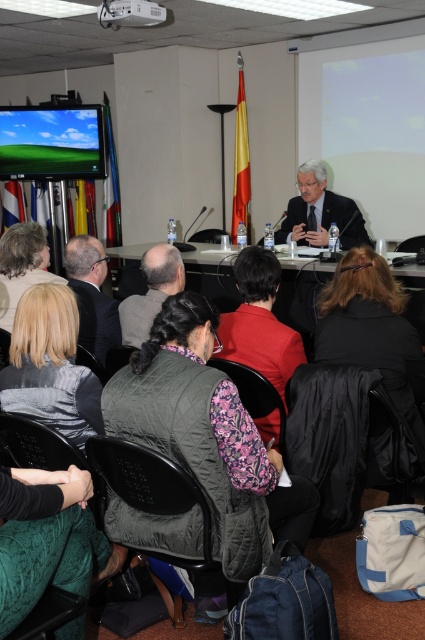
Is blonde hair at lower left positioned in front of white glossy table at center?

Yes, it is.

Can you confirm if blonde hair at lower left is thinner than white glossy table at center?

No, blonde hair at lower left is not thinner than white glossy table at center.

Measure the distance between point (11, 282) and camera.

They are 3.16 meters apart.

The height and width of the screenshot is (640, 425). In order to click on blonde hair at lower left in this screenshot , I will do `click(22, 266)`.

Is matte white projection screen at upper right above green textured sweater at lower left?

Yes.

Who is higher up, matte white projection screen at upper right or green textured sweater at lower left?

matte white projection screen at upper right is higher up.

From the picture: Who is more forward, [345,81] or [13,490]?

Point [13,490] is more forward.

Identify the location of matte white projection screen at upper right. (368, 128).

Is dark green quilted vest at center shorter than matte black suit at center?

Incorrect, dark green quilted vest at center's height does not fall short of matte black suit at center's.

Find the location of a particular element. Image resolution: width=425 pixels, height=640 pixels. dark green quilted vest at center is located at coordinates (207, 444).